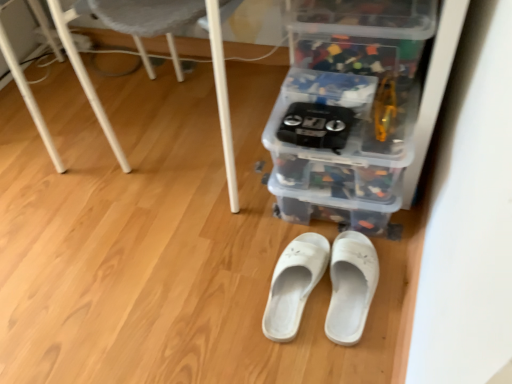
Image resolution: width=512 pixels, height=384 pixels. In order to click on empty space that is in between white plastic chair at lower center and white fabric slippers at center, the 1th footwear from the left in this screenshot , I will do `click(211, 236)`.